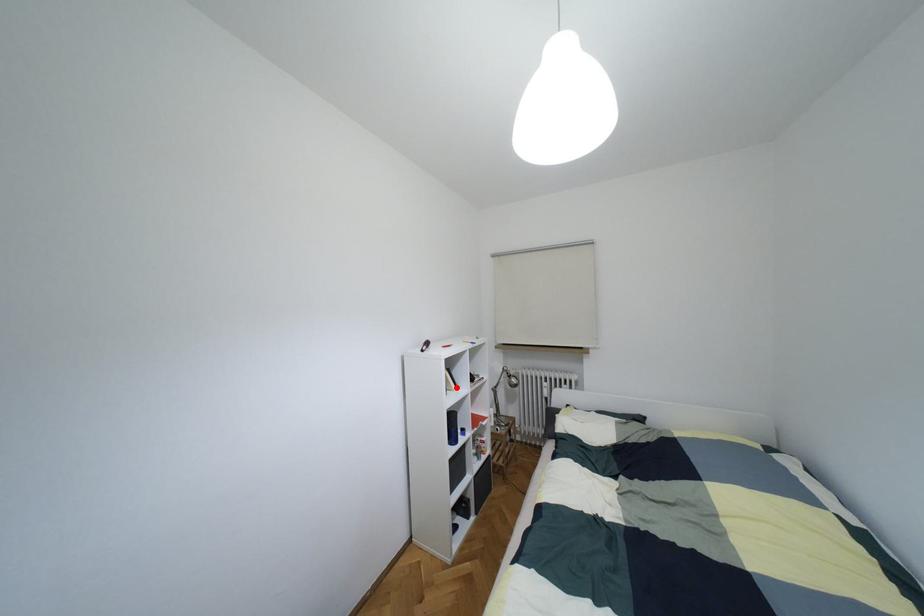
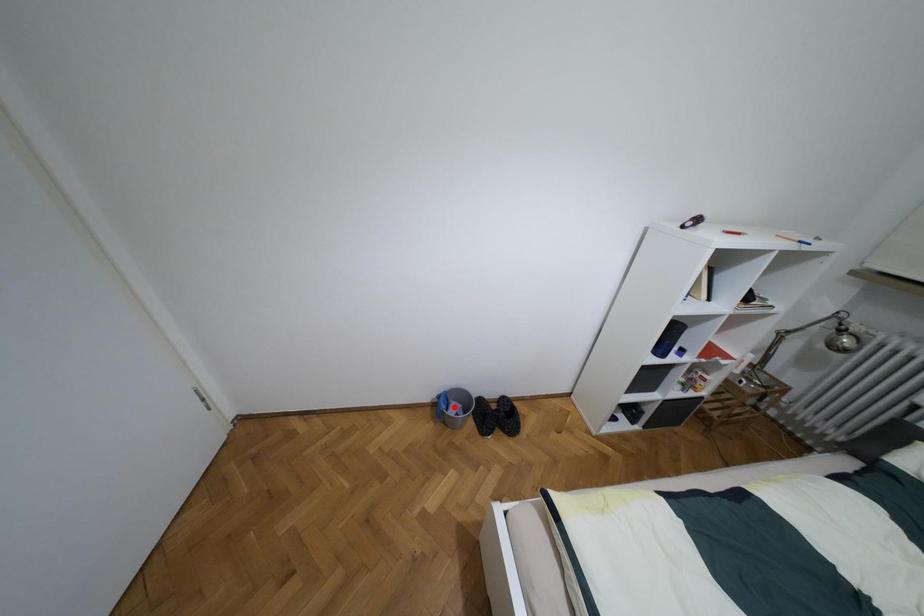
I am providing you with two images of the same scene from different viewpoints. A red point is marked on the first image and another point is marked on the second image. Are the points marked in image1 and image2 representing the same 3D position?

No